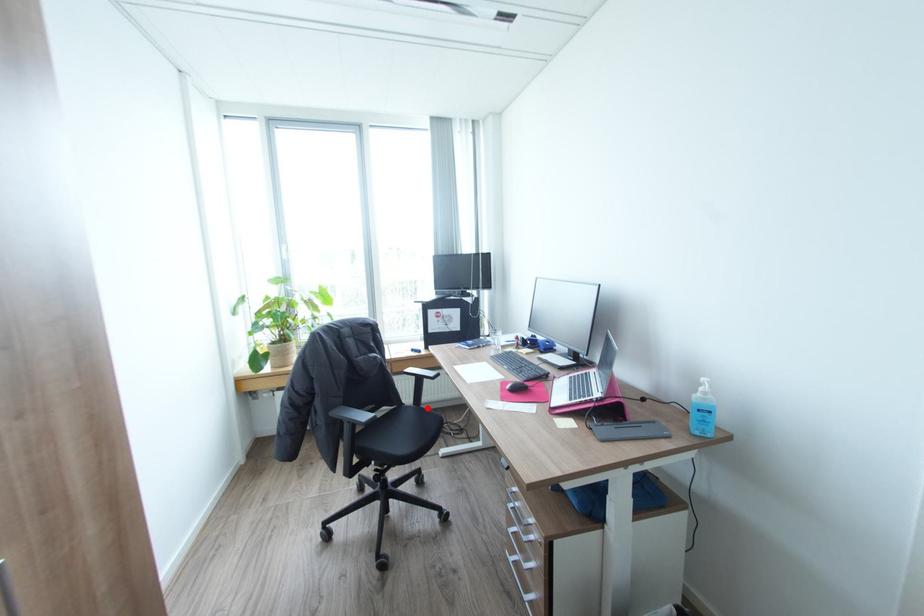
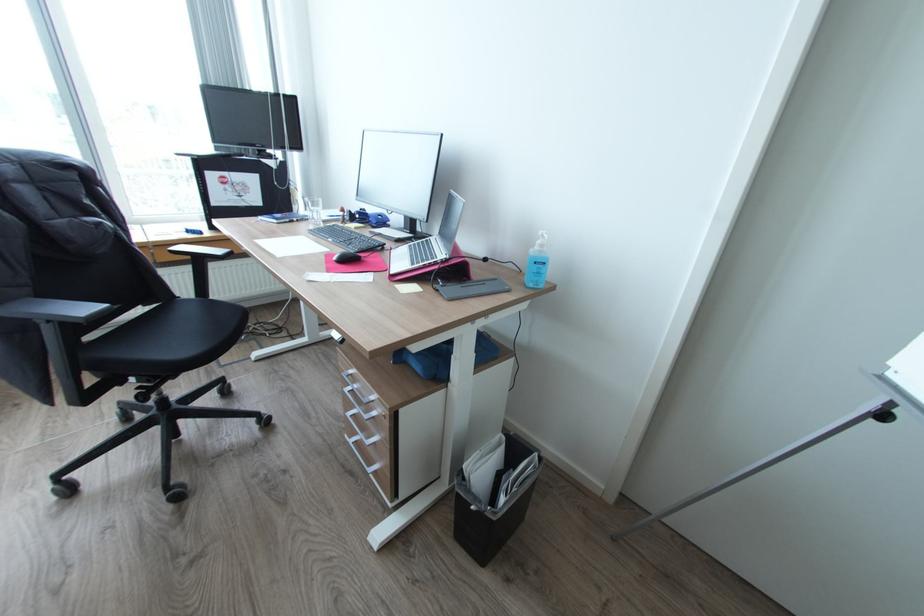
Question: I am providing you with two images of the same scene from different viewpoints. A red point is marked on the first image. Is the red point's position out of view in image 2?

Choices:
 (A) Yes
 (B) No

Answer: (B)